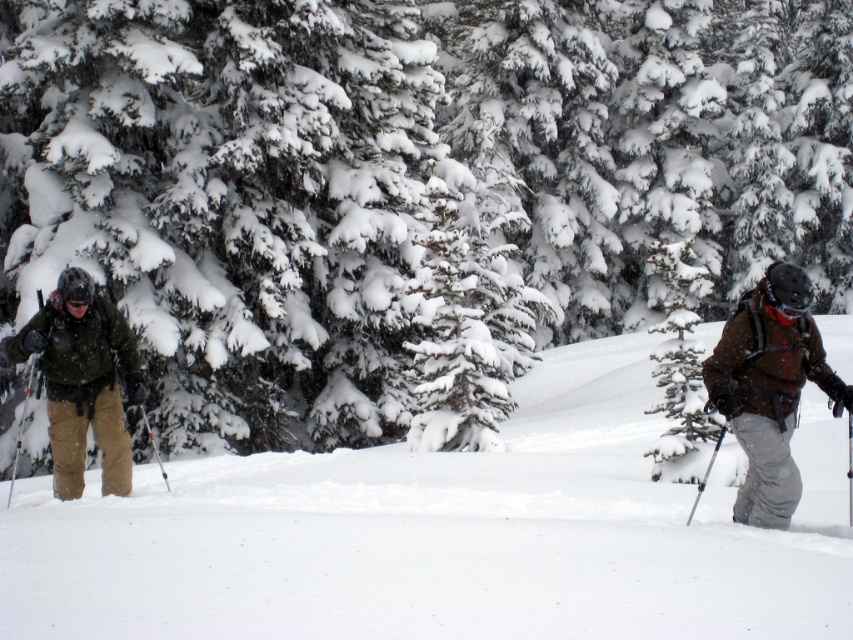
Question: From the image, what is the correct spatial relationship of white snow ski slope at left in relation to matte green jacket at left?

Choices:
 (A) above
 (B) below

Answer: (B)

Question: Which object appears farthest from the camera in this image?

Choices:
 (A) brown woolen jacket at right
 (B) matte green jacket at left

Answer: (B)

Question: Where is white snow ski slope at left located in relation to matte green jacket at left in the image?

Choices:
 (A) above
 (B) below

Answer: (B)

Question: Which object is the closest to the matte green jacket at left?

Choices:
 (A) white snow ski slope at left
 (B) brown woolen jacket at right

Answer: (A)

Question: Can you confirm if white snow ski slope at left is positioned below matte green jacket at left?

Choices:
 (A) yes
 (B) no

Answer: (A)

Question: Considering the real-world distances, which object is farthest from the brown woolen jacket at right?

Choices:
 (A) white snow ski slope at left
 (B) matte green jacket at left

Answer: (B)